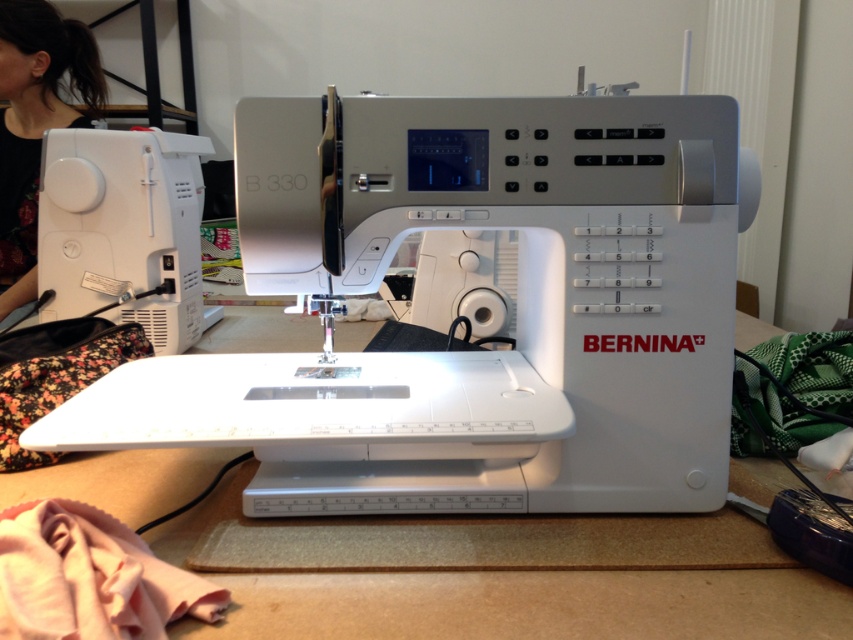
Based on the photo, you are a sewing enthusiast who wants to place a 1.2 meter wide quilt on your work area. Given the white matte table at center and the black fabric at upper left, which surface can accommodate the quilt without folding?

The white matte table at center is wider than the black fabric at upper left, so the quilt can be placed on the white matte table at center without folding.

You are setting up a sewing project and need to place both the white matte table at center and the black fabric at upper left on your work area. Based on their sizes, which item should you place first to ensure there is enough space for both?

The white matte table at center has a smaller size compared to black fabric at upper left, so you should place the black fabric at upper left first to ensure there is enough space for both.